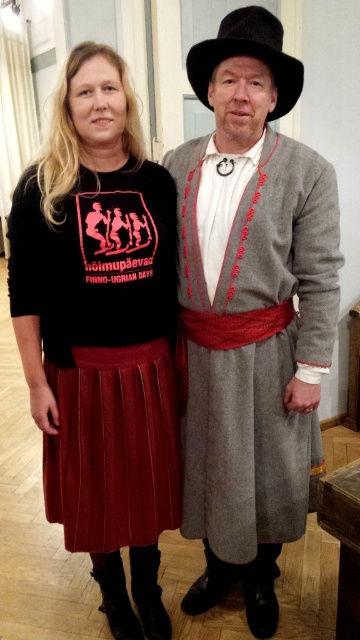
You are a photographer at the event and need to capture a shot where both the velvet skirt at center and the burgundy pleated skirt at lower left are visible. Based on their positions, which skirt is covering part of the other?

The velvet skirt at center is positioned over the burgundy pleated skirt at lower left, so it is covering part of it.

You are a photographer at the event and want to capture both the velvet skirt at center and the burgundy pleated skirt at lower left in the same frame. Based on their positions, which skirt is closer to the left edge of the photo?

The velvet skirt at center is closer to the left edge of the photo because it is positioned to the left of the burgundy pleated skirt at lower left.

You are a photographer trying to capture a closeup of the point at coordinates point (x=66, y=502) and point (x=275, y=16). Which point should you focus on to get the closest shot without moving your camera?

Point (x=66, y=502) is closer to the camera than point (x=275, y=16), so you should focus on point (x=66, y=502) to get the closest shot.